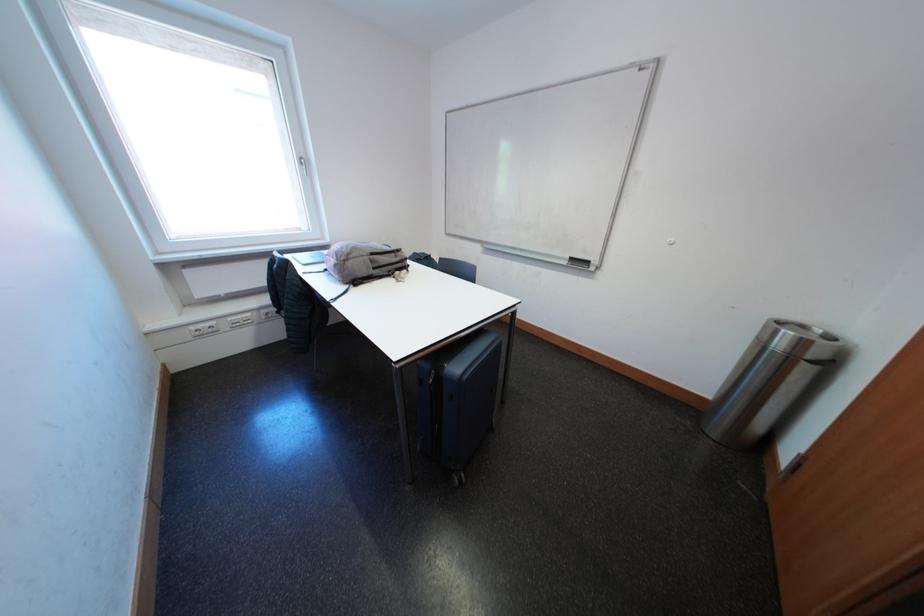
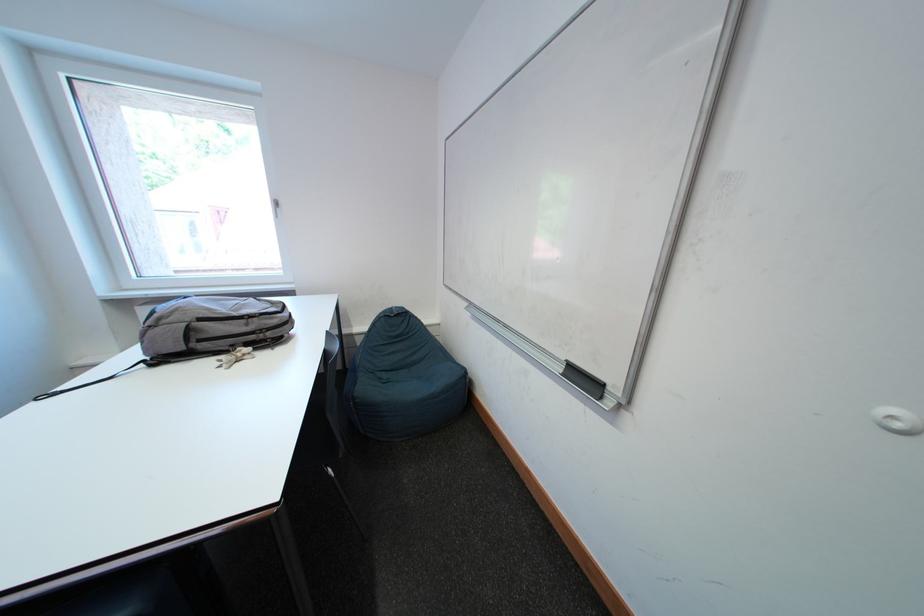
Looking at this image, the images are taken continuously from a first-person perspective. In which direction are you moving?

The cameraman moved toward right, forward.